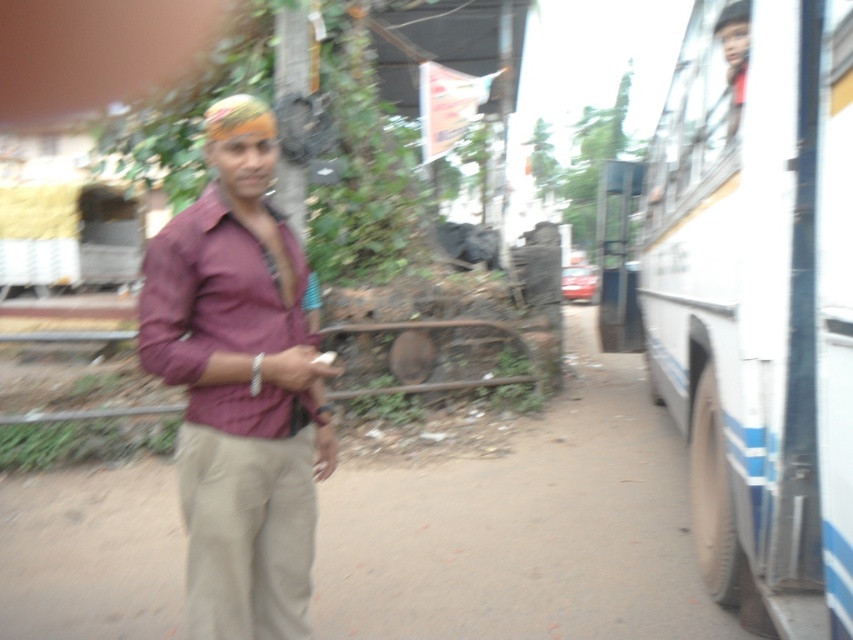
Is white matte bus at right to the left of khaki pants at center from the viewer's perspective?

Incorrect, white matte bus at right is not on the left side of khaki pants at center.

Is point (714, 102) closer to camera compared to point (219, 392)?

No, it is not.

Where is `white matte bus at right`? The width and height of the screenshot is (853, 640). white matte bus at right is located at coordinates (759, 300).